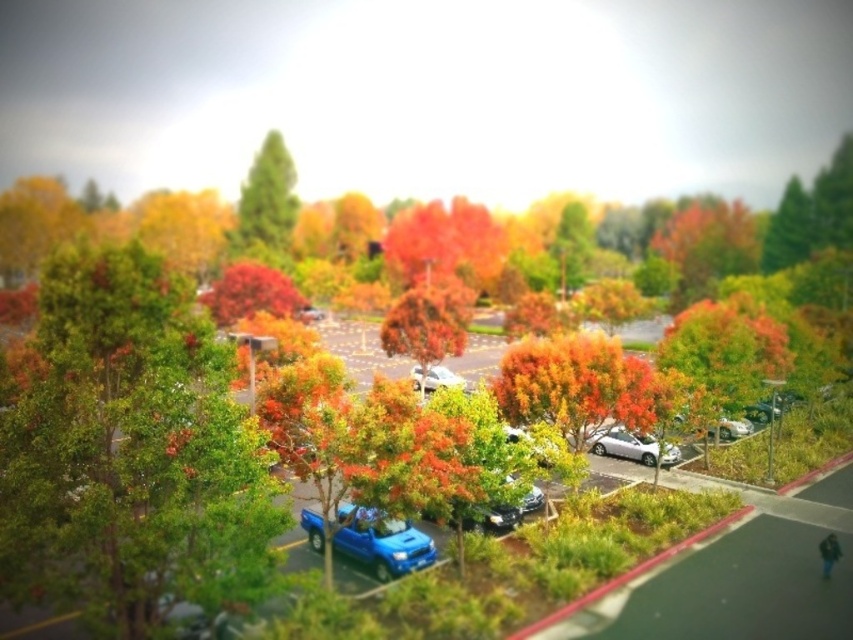
You are a delivery driver who needs to exit the parking lot. You see the shiny blue pickup truck at center and the satin silver sedan at center. Which vehicle is blocking your path?

The shiny blue pickup truck at center is blocking your path because it is in front of the satin silver sedan at center.

You are a delivery person needing to park your vehicle in the parking lot. You see the green matte tree at upper center and the shiny metallic car at center. How far apart are these two objects?

The green matte tree at upper center and the shiny metallic car at center are 73.79 meters apart.

You are standing in the parking lot and want to locate the green matte tree at upper center. According to the coordinates provided, where should you look?

The green matte tree at upper center is located at point coordinates of [267,202].